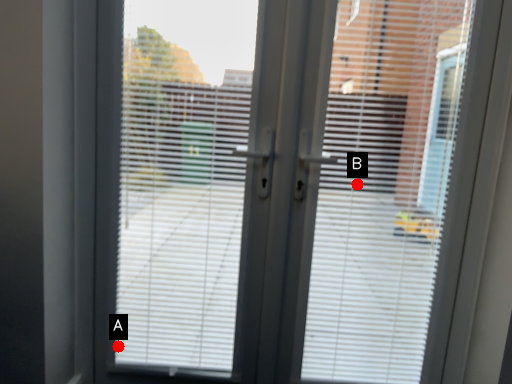
Question: Two points are circled on the image, labeled by A and B beside each circle. Which point is closer to the camera?

Choices:
 (A) A is closer
 (B) B is closer

Answer: (B)